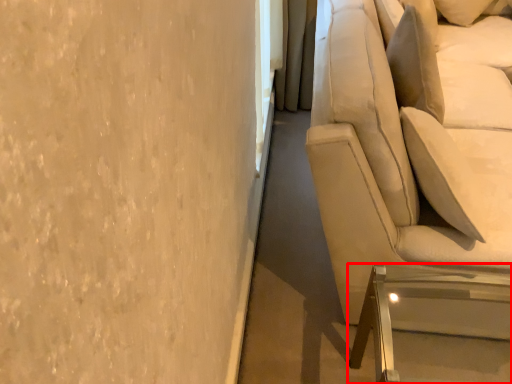
Question: In this image, where is furniture (annotated by the red box) located relative to studio couch?

Choices:
 (A) right
 (B) left

Answer: (B)